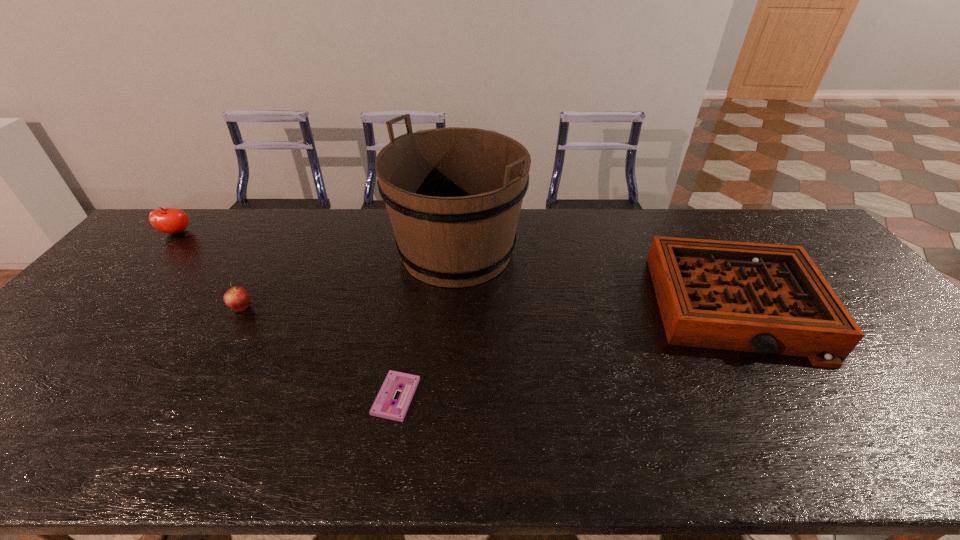
At what (x,y) coordinates should I click in order to perform the action: click on vacant space situated 0.300m on the right of the right apple. Please return your answer as a coordinate pair (x, y). This screenshot has height=540, width=960. Looking at the image, I should click on (363, 308).

This screenshot has width=960, height=540. I want to click on free space located 0.240m on the front of the rightmost object, so click(835, 466).

Locate an element on the screen. Image resolution: width=960 pixels, height=540 pixels. vacant space situated on the back of the nearest object is located at coordinates (415, 284).

The width and height of the screenshot is (960, 540). In order to click on bucket that is at the far edge in this screenshot , I will do `click(453, 195)`.

Find the location of a particular element. This screenshot has width=960, height=540. apple at the far edge is located at coordinates (167, 220).

Where is `object that is positioned at the left edge`? The height and width of the screenshot is (540, 960). object that is positioned at the left edge is located at coordinates (167, 220).

This screenshot has height=540, width=960. I want to click on object located at the far left corner, so click(167, 220).

This screenshot has height=540, width=960. Find the location of `free space at the far edge`. free space at the far edge is located at coordinates (365, 230).

This screenshot has width=960, height=540. In order to click on free space at the near edge of the desktop in this screenshot , I will do `click(355, 442)`.

In the image, there is a desktop. At what (x,y) coordinates should I click in order to perform the action: click on free space at the left edge. Please return your answer as a coordinate pair (x, y). The height and width of the screenshot is (540, 960). Looking at the image, I should click on [74, 316].